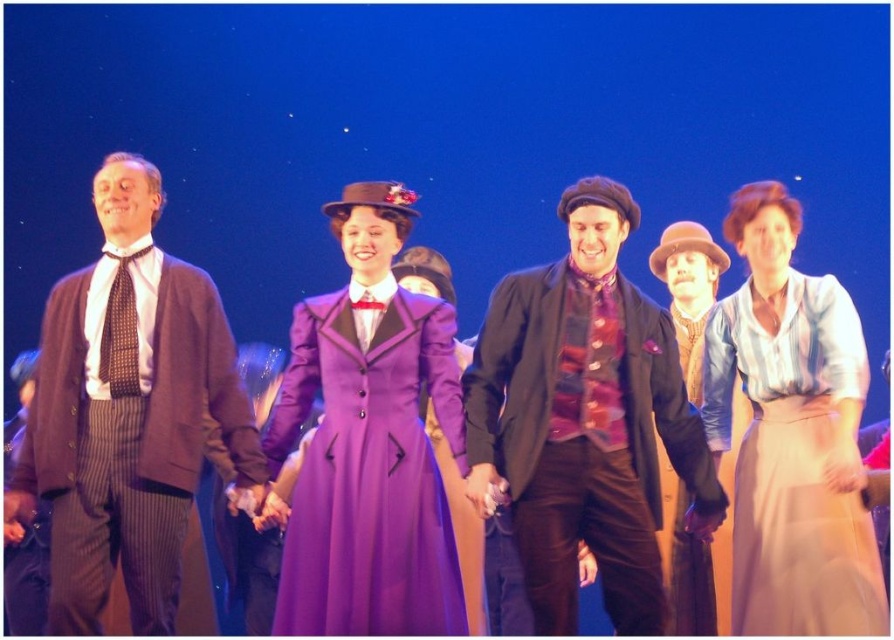
From the picture: You are an audience member sitting in the front row of the theater. You notice two performers on stage wearing the velvet black coat at center and the striped wool suit at left. Which performer is standing to the right of the other?

The velvet black coat at center is positioned on the right side of striped wool suit at left, so the performer wearing the velvet black coat at center is standing to the right of the one in the striped wool suit at left.